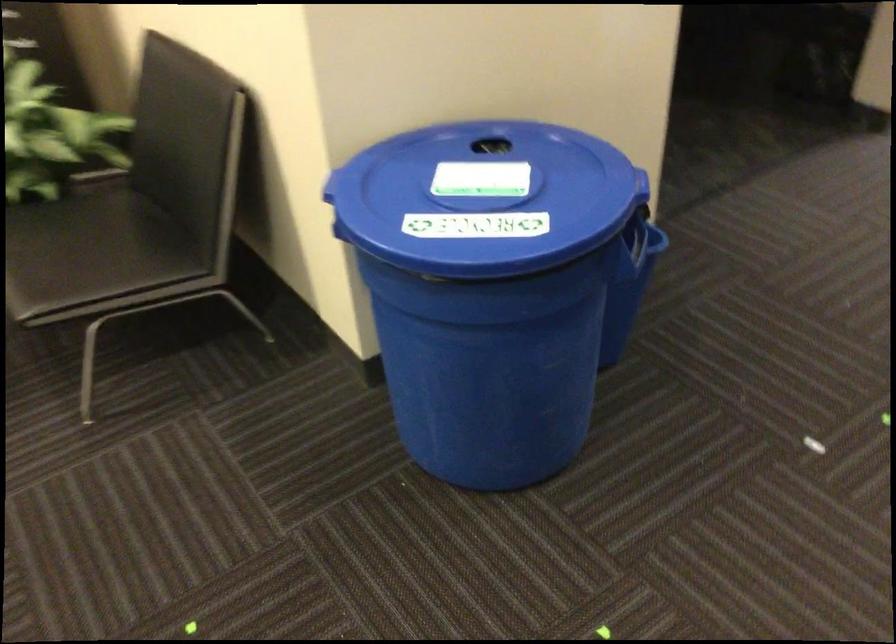
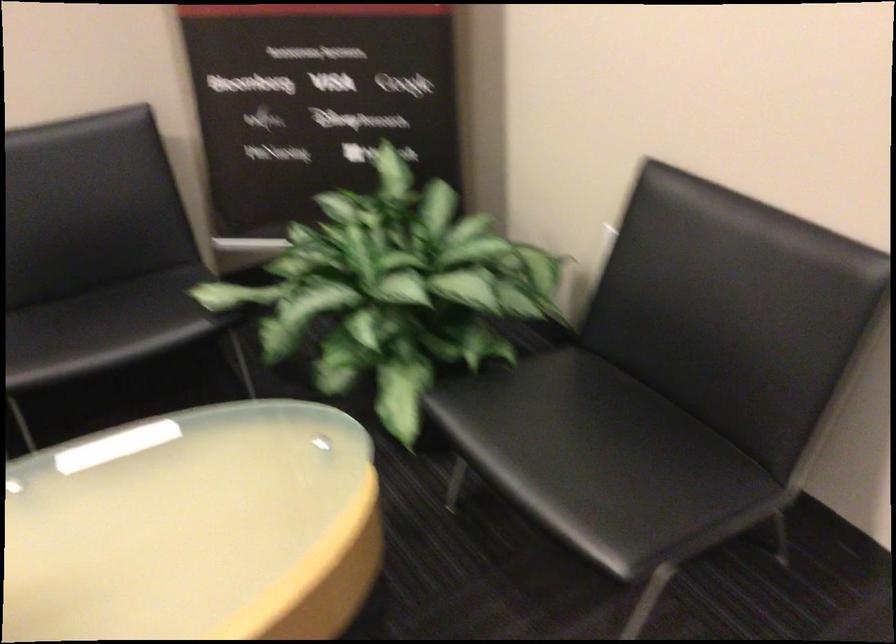
In a continuous first-person perspective shot, in which direction is the camera moving?

The cameraman walked toward left, forward.